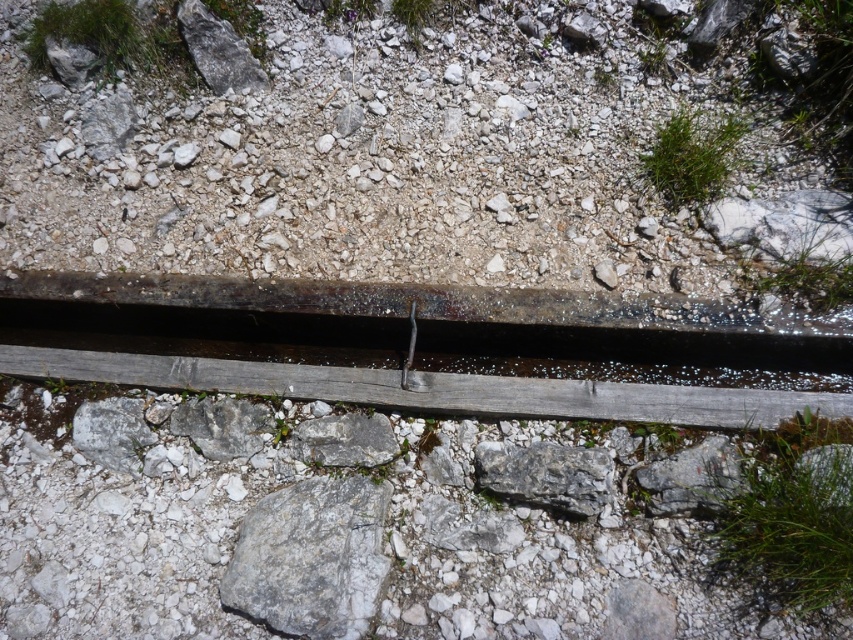
Question: Is gray rough rock at center to the right of gray rough stone at center from the viewer's perspective?

Choices:
 (A) no
 (B) yes

Answer: (A)

Question: Can you confirm if rusty metal rail at center is smaller than gray/rough gravel at center?

Choices:
 (A) no
 (B) yes

Answer: (A)

Question: Which is farther from the gray rough rock at lower right?

Choices:
 (A) gray rough stone at center
 (B) gray rough rock at center

Answer: (B)

Question: Among these points, which one is nearest to the camera?

Choices:
 (A) (682, 604)
 (B) (560, 467)
 (C) (730, 445)

Answer: (A)

Question: Which of the following is the closest to the observer?

Choices:
 (A) (421, 118)
 (B) (519, 492)
 (C) (415, 314)
 (D) (378, 576)

Answer: (D)

Question: Is gray rough stone at center thinner than rusty metal pipe at center?

Choices:
 (A) yes
 (B) no

Answer: (B)